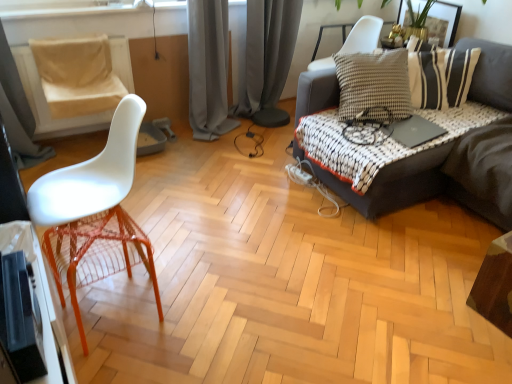
You are a GUI agent. You are given a task and a screenshot of the screen. Output one action in this format:
    pyautogui.click(x=<x>, y=<y>)
    Task: Click on the vacant area that is in front of gray fabric curtain at center, the 2th curtain from the right
    This screenshot has height=384, width=512.
    Given the screenshot: What is the action you would take?
    pyautogui.click(x=211, y=160)